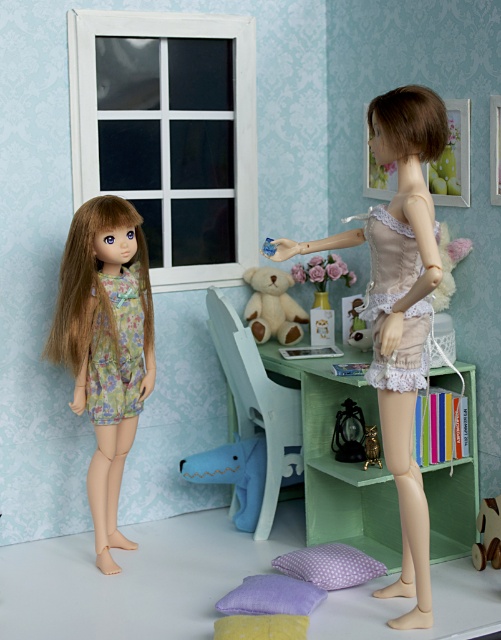
Question: Is matte beige lace dress at center bigger than lavender dotted pillow at lower center?

Choices:
 (A) yes
 (B) no

Answer: (A)

Question: Which of the following is the closest to the observer?

Choices:
 (A) purple fabric pillow at lower center
 (B) matte beige lace dress at center
 (C) matte floral dress at left

Answer: (B)

Question: Estimate the real-world distances between objects in this image. Which object is farther from the matte beige lace dress at center?

Choices:
 (A) purple fabric pillow at lower center
 (B) soft beige plush at center

Answer: (B)

Question: Does purple fabric pillow at lower center lie behind wooden horse at lower right?

Choices:
 (A) yes
 (B) no

Answer: (B)

Question: Considering the real-world distances, which object is farthest from the lavender dotted pillow at lower center?

Choices:
 (A) purple fabric pillow at lower center
 (B) wooden horse at lower right

Answer: (B)

Question: Is soft beige plush at center thinner than lavender dotted pillow at lower center?

Choices:
 (A) no
 (B) yes

Answer: (B)